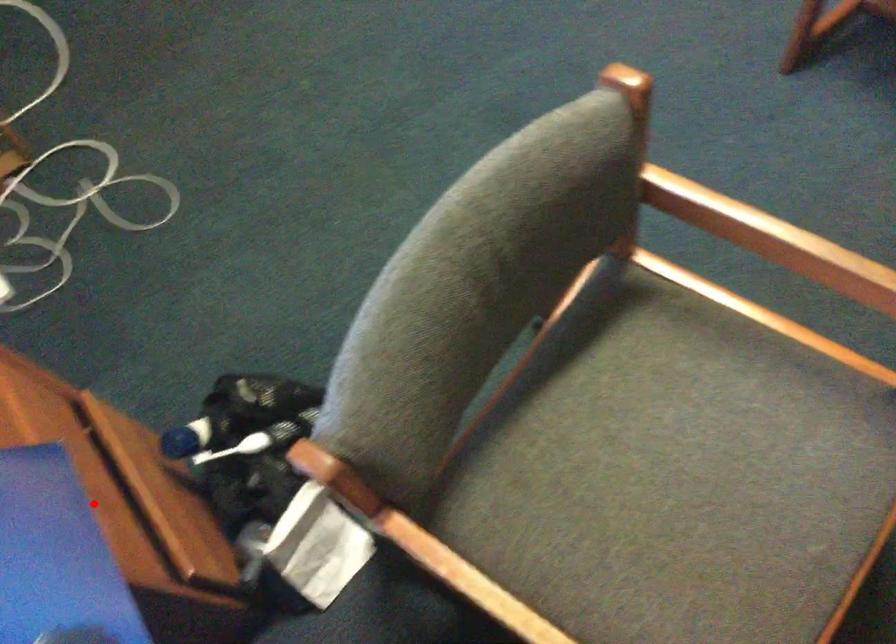
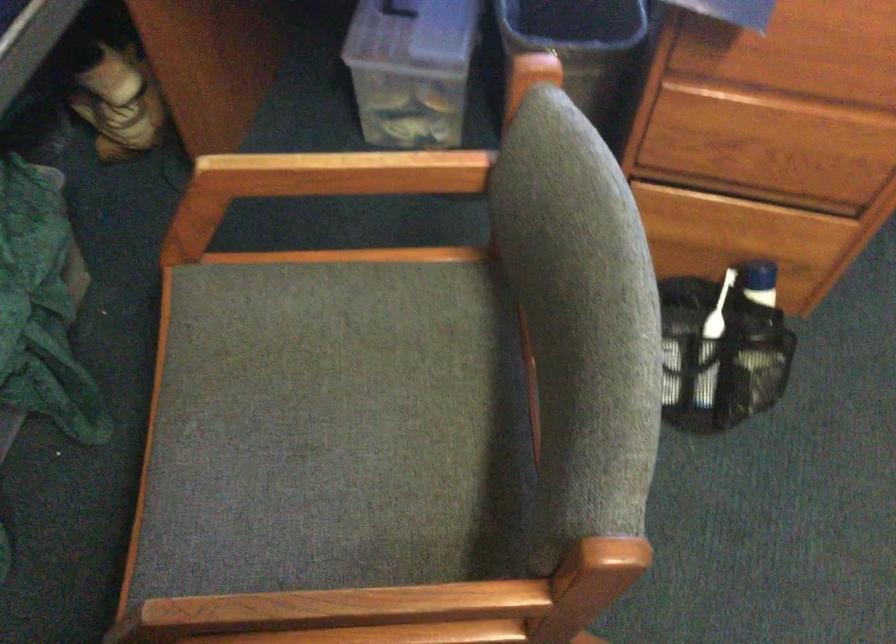
Question: I am providing you with two images of the same scene from different viewpoints. Image1 has a red point marked. In image2, the corresponding 3D location appears at what relative position? Reply with the corresponding letter.

Choices:
 (A) Closer
 (B) Farther

Answer: (B)